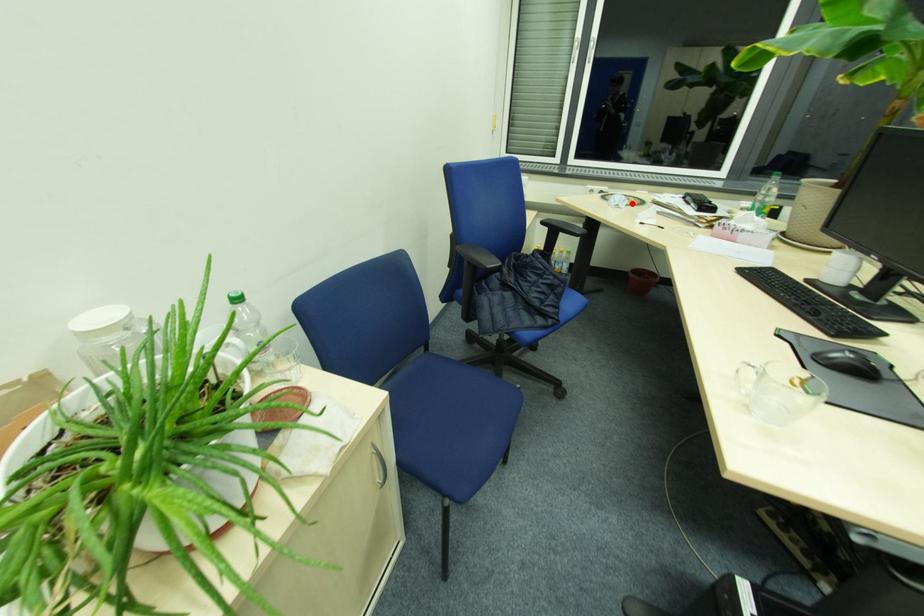
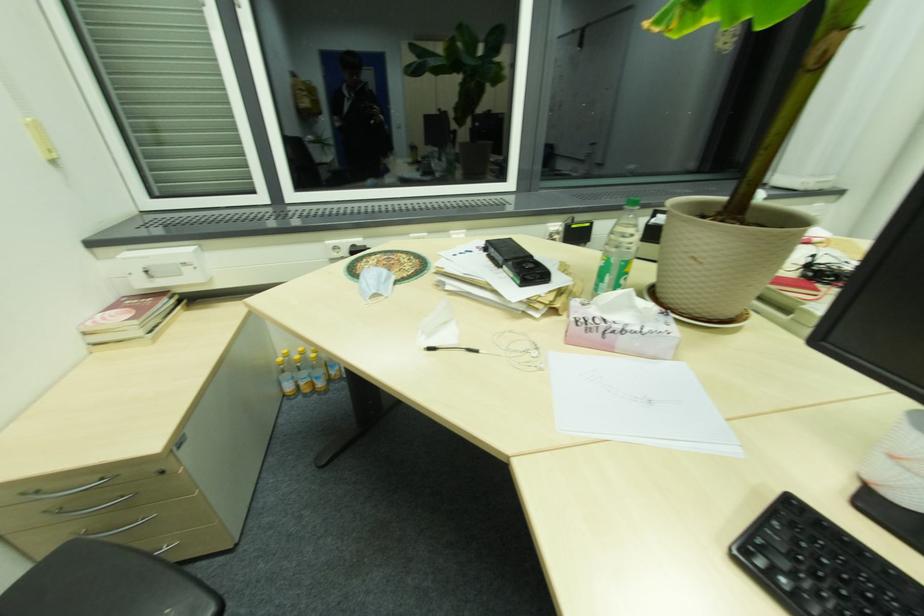
Question: A red point is marked in image1. In image2, is the corresponding 3D point closer to the camera or farther? Reply with the corresponding letter.

Choices:
 (A) The corresponding 3D point is closer.
 (B) The corresponding 3D point is farther.

Answer: (B)